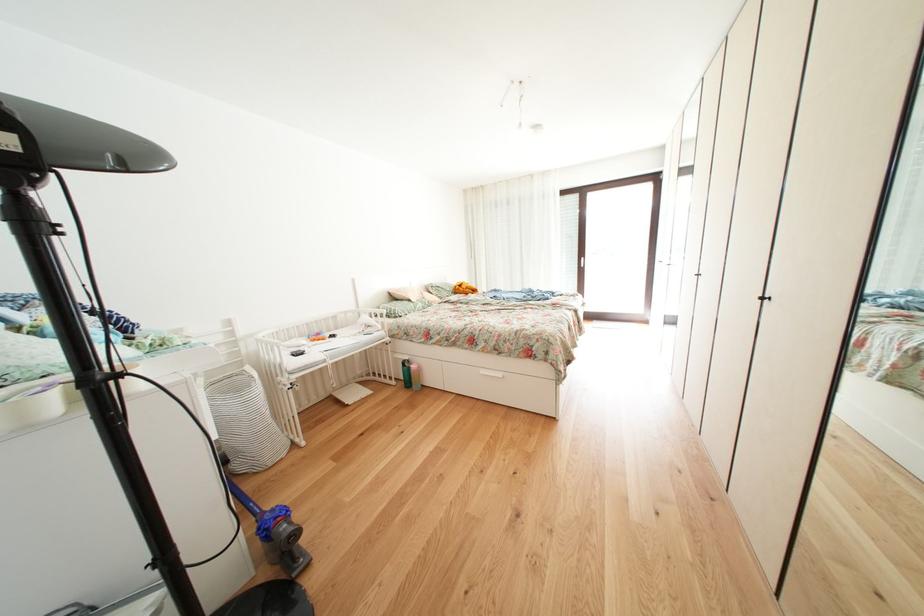
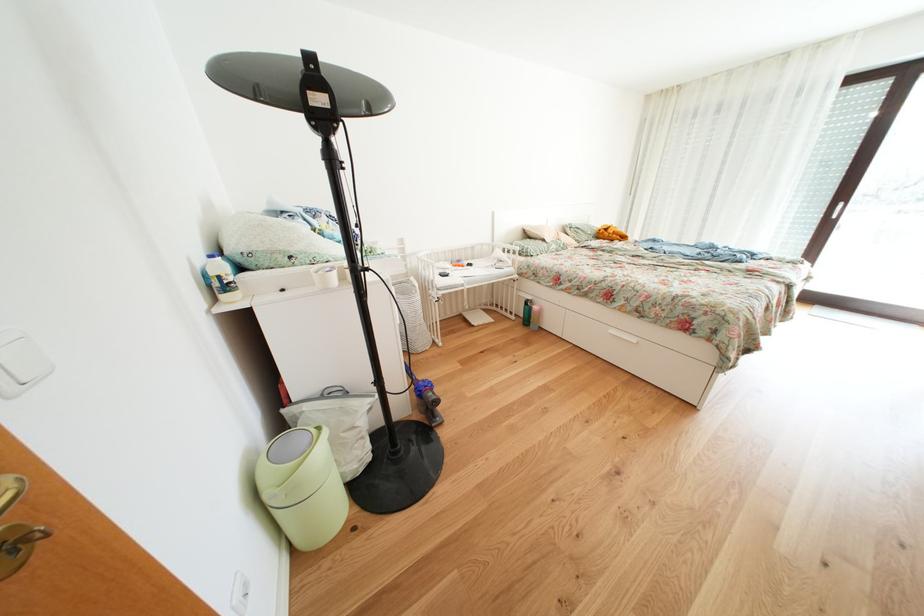
Locate, in the second image, the point that corresponds to (403,387) in the first image.

(523, 323)